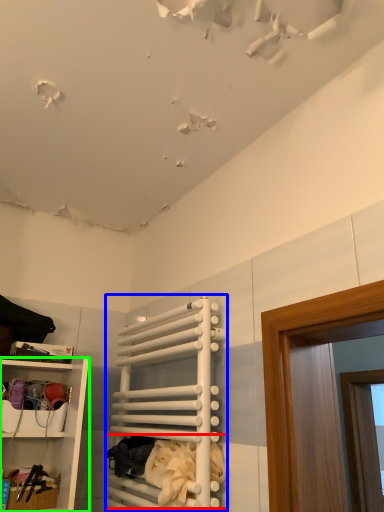
Question: Estimate the real-world distances between objects in this image. Which object is closer to laundry (highlighted by a red box), cabinet (highlighted by a blue box) or shelf (highlighted by a green box)?

Choices:
 (A) cabinet
 (B) shelf

Answer: (A)